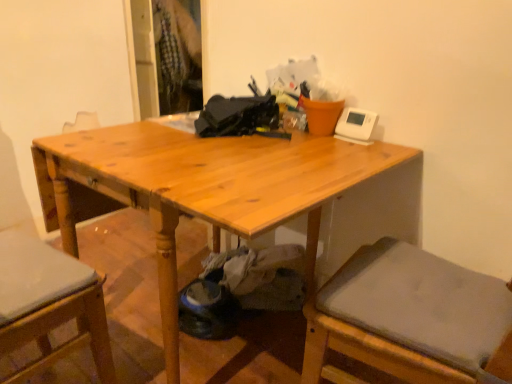
Question: Visually, is light brown wood table at center positioned to the left or to the right of wooden chair at left?

Choices:
 (A) left
 (B) right

Answer: (B)

Question: Is light brown wood table at center inside or outside of wooden chair at left?

Choices:
 (A) outside
 (B) inside

Answer: (A)

Question: Considering the positions of light brown wood table at center and wooden chair at left in the image, is light brown wood table at center wider or thinner than wooden chair at left?

Choices:
 (A) thin
 (B) wide

Answer: (B)

Question: In terms of height, does wooden chair at left look taller or shorter compared to light brown wood table at center?

Choices:
 (A) tall
 (B) short

Answer: (A)

Question: Is wooden chair at left bigger or smaller than light brown wood table at center?

Choices:
 (A) small
 (B) big

Answer: (A)

Question: In the image, is wooden chair at left positioned in front of or behind light brown wood table at center?

Choices:
 (A) behind
 (B) front

Answer: (B)

Question: From the image's perspective, is wooden chair at left above or below light brown wood table at center?

Choices:
 (A) above
 (B) below

Answer: (B)